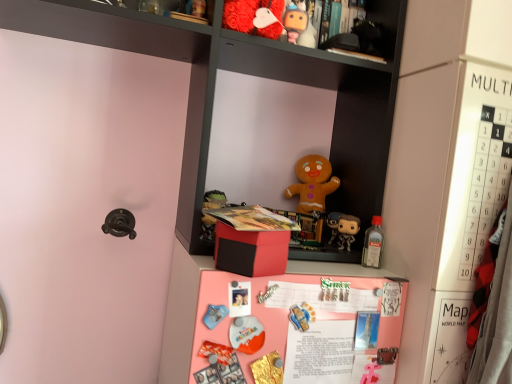
What is the approximate width of matte orange plush toy at center, arranged as the 6th toy when viewed from the top?

The width of matte orange plush toy at center, arranged as the 6th toy when viewed from the top, is 1.48 centimeters.

This screenshot has width=512, height=384. What do you see at coordinates (254, 17) in the screenshot? I see `velvet plush heart at upper center, placed as the 6th toy when sorted from back to front` at bounding box center [254, 17].

Where is `matte black cabinet at upper center`? This screenshot has width=512, height=384. matte black cabinet at upper center is located at coordinates (306, 85).

Describe the element at coordinates (295, 20) in the screenshot. I see `matte plastic figurine at upper center, the sixth toy from the bottom` at that location.

The height and width of the screenshot is (384, 512). I want to click on matte orange plush toy at center, arranged as the 6th toy when viewed from the top, so click(x=246, y=334).

Which is correct: matte black figurine at center-right, the 4th toy from the bottom, is inside red matte box at center, or outside of it?

matte black figurine at center-right, the 4th toy from the bottom, is spatially situated outside red matte box at center.

Is matte black figurine at center-right, the 2th toy when ordered from back to front, smaller than red matte box at center?

Yes.

Does matte black figurine at center-right, the 4th toy from the bottom, appear on the right side of red matte box at center?

Correct, you'll find matte black figurine at center-right, the 4th toy from the bottom, to the right of red matte box at center.

Is translucent plastic bottle at upper right, the 5th toy when ordered from top to bottom, aimed at red matte box at center?

No, translucent plastic bottle at upper right, the 5th toy when ordered from top to bottom, is not turned towards red matte box at center.

From the image's perspective, is translucent plastic bottle at upper right, the third toy when ordered from back to front, located above red matte box at center?

No.

From a real-world perspective, is translucent plastic bottle at upper right, placed as the fifth toy when sorted from front to back, over red matte box at center?

Correct, in the physical world, translucent plastic bottle at upper right, placed as the fifth toy when sorted from front to back, is higher than red matte box at center.

Which is nearer, [379,230] or [251,214]?

The point [251,214] is closer.

Can you confirm if matte black cabinet at upper center is bigger than matte gingerbread man at center, which ranks as the 3th toy in top-to-bottom order?

Correct, matte black cabinet at upper center is larger in size than matte gingerbread man at center, which ranks as the 3th toy in top-to-bottom order.

Which of these two, matte black cabinet at upper center or matte gingerbread man at center, which ranks as the 3th toy in top-to-bottom order, is wider?

Wider between the two is matte black cabinet at upper center.

Is matte black cabinet at upper center aimed at matte gingerbread man at center, the 7th toy from the front?

Yes, matte black cabinet at upper center is aimed at matte gingerbread man at center, the 7th toy from the front.

From a real-world perspective, which is physically below, red matte box at center or velvet plush heart at upper center, placed as the 6th toy when sorted from back to front?

red matte box at center is physically lower.

From the image's perspective, is red matte box at center under velvet plush heart at upper center, placed as the 6th toy when sorted from back to front?

Yes.

Based on the photo, which object is closer to the camera, red matte box at center or velvet plush heart at upper center, the 1th toy in the top-to-bottom sequence?

red matte box at center is more forward.

Considering the sizes of matte plastic figurine at upper center, which appears as the second toy when viewed from the top, and red matte box at center in the image, is matte plastic figurine at upper center, which appears as the second toy when viewed from the top, taller or shorter than red matte box at center?

Considering their sizes, matte plastic figurine at upper center, which appears as the second toy when viewed from the top, has more height than red matte box at center.

Which object is thinner, matte plastic figurine at upper center, placed as the fourth toy when sorted from back to front, or red matte box at center?

matte plastic figurine at upper center, placed as the fourth toy when sorted from back to front.

How many degrees apart are the facing directions of matte plastic figurine at upper center, placed as the fourth toy when sorted from back to front, and red matte box at center?

There is a 17.5-degree angle between the facing directions of matte plastic figurine at upper center, placed as the fourth toy when sorted from back to front, and red matte box at center.

Consider the image. Considering the relative positions of matte plastic figurine at upper center, the fourth toy from the front, and red matte box at center in the image provided, is matte plastic figurine at upper center, the fourth toy from the front, in front of red matte box at center?

No, the depth of matte plastic figurine at upper center, the fourth toy from the front, is greater than that of red matte box at center.

From the picture: Between matte black cabinet at upper center and matte orange plush toy at center, the 7th toy from the back, which one appears on the right side from the viewer's perspective?

matte orange plush toy at center, the 7th toy from the back.

Consider the image. Could you tell me if matte black cabinet at upper center is facing matte orange plush toy at center, arranged as the 6th toy when viewed from the top?

No, matte black cabinet at upper center is not oriented towards matte orange plush toy at center, arranged as the 6th toy when viewed from the top.

From a real-world perspective, is matte black cabinet at upper center physically located above or below matte orange plush toy at center, which is counted as the 1th toy, starting from the front?

In terms of real-world spatial position, matte black cabinet at upper center is above matte orange plush toy at center, which is counted as the 1th toy, starting from the front.

Considering the sizes of objects matte plastic figurine at upper center, placed as the fourth toy when sorted from back to front, and matte orange plush toy at center, arranged as the 6th toy when viewed from the top, in the image provided, who is bigger, matte plastic figurine at upper center, placed as the fourth toy when sorted from back to front, or matte orange plush toy at center, arranged as the 6th toy when viewed from the top,?

Bigger between the two is matte plastic figurine at upper center, placed as the fourth toy when sorted from back to front.

Looking at this image, can you see matte plastic figurine at upper center, placed as the fourth toy when sorted from back to front, touching matte orange plush toy at center, arranged as the 6th toy when viewed from the top?

There is a gap between matte plastic figurine at upper center, placed as the fourth toy when sorted from back to front, and matte orange plush toy at center, arranged as the 6th toy when viewed from the top.

Starting from the red matte box at center, which toy is the 5th one to the right? Please provide its 2D coordinates.

[(343, 229)]

I want to click on the 5th toy behind when counting from the red matte box at center, so click(x=373, y=244).

Looking at the image, which one is located closer to translucent plastic bottle at upper right, the third toy when ordered from back to front, matte black cabinet at upper center or matte black figurine at center-right, the fourth toy viewed from the top?

matte black figurine at center-right, the fourth toy viewed from the top, is positioned closer to the anchor translucent plastic bottle at upper right, the third toy when ordered from back to front.

Which object lies nearer to the anchor point red matte box at center, matte gingerbread man at center, acting as the fifth toy starting from the bottom, or matte black figurine at center-right, the sixth toy from the front?

matte black figurine at center-right, the sixth toy from the front, is closer to red matte box at center.

When comparing their distances from velvet plush heart at upper center, placed as the 6th toy when sorted from back to front, does matte plastic figurine at upper center, which appears as the second toy when viewed from the top, or matte black figurine at center-right, the 4th toy from the bottom, seem further?

matte black figurine at center-right, the 4th toy from the bottom, is further to velvet plush heart at upper center, placed as the 6th toy when sorted from back to front.

Which object lies nearer to the anchor point velvet plush heart at upper center, marked as the second toy in a front-to-back arrangement, matte orange plush toy at center, which is the 2th toy in bottom-to-top order, or matte black cabinet at upper center?

Among the two, matte black cabinet at upper center is located nearer to velvet plush heart at upper center, marked as the second toy in a front-to-back arrangement.

Estimate the real-world distances between objects in this image. Which object is closer to red matte box at center, matte black figurine at center-right, the fourth toy viewed from the top, or matte plastic figurine at upper center, placed as the fourth toy when sorted from back to front?

matte black figurine at center-right, the fourth toy viewed from the top, lies closer to red matte box at center than the other object.

Based on their spatial positions, is matte plastic figurine at upper center, the fourth toy from the front, or translucent plastic bottle at upper right, the 3th toy from the bottom, further from matte black cabinet at upper center?

translucent plastic bottle at upper right, the 3th toy from the bottom, is further to matte black cabinet at upper center.

Estimate the real-world distances between objects in this image. Which object is closer to matte black cabinet at upper center, matte gingerbread man at center, arranged as the first toy when viewed from the back, or red matte box at center?

matte gingerbread man at center, arranged as the first toy when viewed from the back, is positioned closer to the anchor matte black cabinet at upper center.

In the scene shown: Based on their spatial positions, is red matte box at center or matte gingerbread man at center, the 7th toy from the front, further from matte plastic figurine at upper center, the fourth toy from the front?

Among the two, red matte box at center is located further to matte plastic figurine at upper center, the fourth toy from the front.

I want to click on box that lies between matte black cabinet at upper center and metallic silver toy at center, the 1th toy in the bottom-to-top sequence, from top to bottom, so click(251, 241).

Locate an element on the screen. box between matte plastic figurine at upper center, which appears as the second toy when viewed from the top, and metallic silver toy at center, placed as the 7th toy when sorted from top to bottom, vertically is located at coordinates 251,241.

The width and height of the screenshot is (512, 384). Identify the location of box between matte plastic figurine at upper center, placed as the fourth toy when sorted from back to front, and matte orange plush toy at center, arranged as the 6th toy when viewed from the top, from top to bottom. (251, 241).

Where is `cabinet between velvet plush heart at upper center, the 1th toy in the top-to-bottom sequence, and pink matte board at center, in the vertical direction`? cabinet between velvet plush heart at upper center, the 1th toy in the top-to-bottom sequence, and pink matte board at center, in the vertical direction is located at coordinates (306, 85).